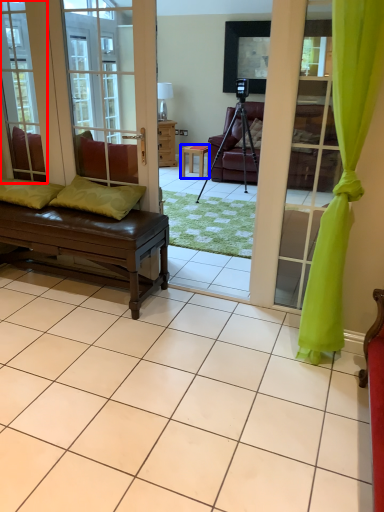
Question: Which of the following is the closest to the observer, window (highlighted by a red box) or table (highlighted by a blue box)?

Choices:
 (A) window
 (B) table

Answer: (A)